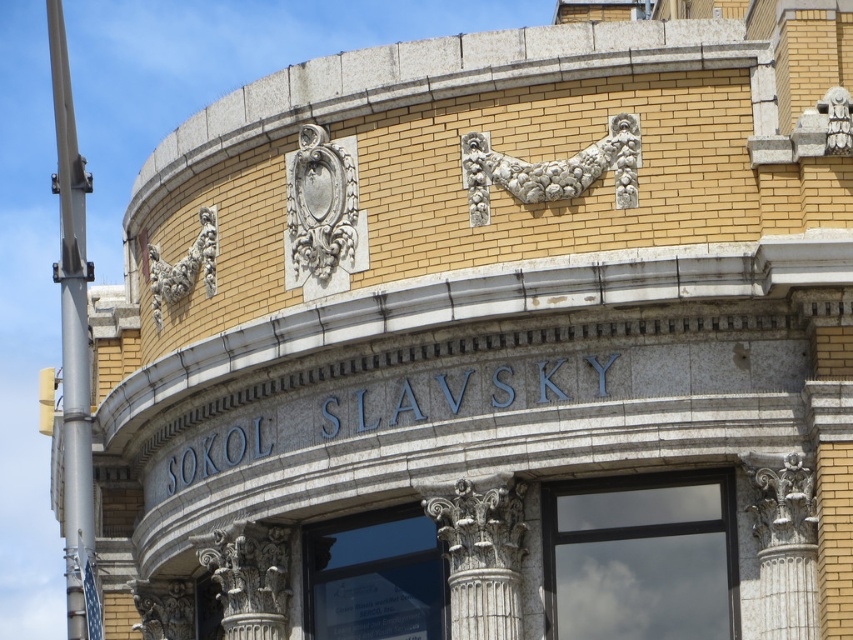
Question: Which point is farther to the camera?

Choices:
 (A) white stone ornament at center
 (B) white stone column at right
 (C) white marble column at center
 (D) carved stone column at lower left

Answer: (D)

Question: Which point is closer to the camera?

Choices:
 (A) white stone column at right
 (B) white stone ornament at center
 (C) carved stone ornament at upper left

Answer: (A)

Question: Considering the relative positions of white stone ornament at center and white stone garland at upper center in the image provided, where is white stone ornament at center located with respect to white stone garland at upper center?

Choices:
 (A) above
 (B) below

Answer: (B)

Question: Does carved stone ornament at upper left appear over carved stone column at lower left?

Choices:
 (A) yes
 (B) no

Answer: (A)

Question: Which object is positioned closest to the white stone garland at upper center?

Choices:
 (A) carved stone column at lower left
 (B) white stone ornament at center
 (C) white marble column at center
 (D) white stone column at center

Answer: (C)

Question: Does metallic pole at left appear over white stone column at center?

Choices:
 (A) no
 (B) yes

Answer: (B)